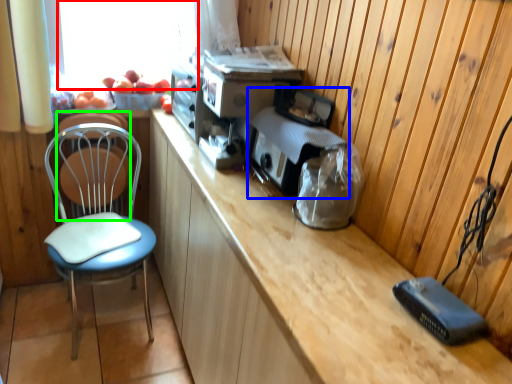
Question: Which object is positioned farthest from window screen (highlighted by a red box)? Select from appliance (highlighted by a blue box) and swivel chair (highlighted by a green box).

Choices:
 (A) appliance
 (B) swivel chair

Answer: (A)